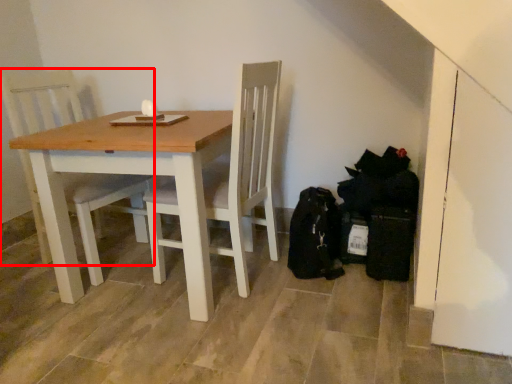
Question: Observing the image, what is the correct spatial positioning of chair (annotated by the red box) in reference to table?

Choices:
 (A) right
 (B) left

Answer: (B)